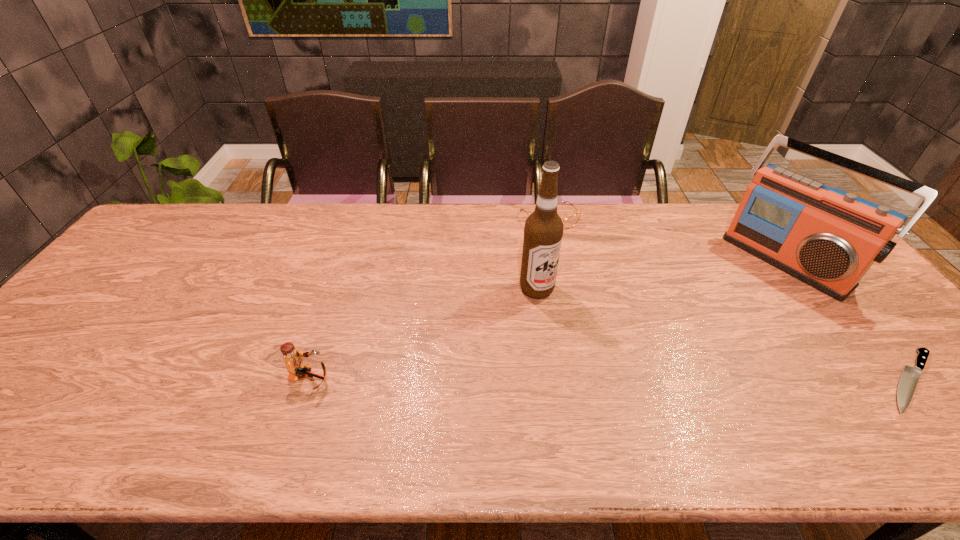
You are a GUI agent. You are given a task and a screenshot of the screen. Output one action in this format:
    pyautogui.click(x=<x>, y=<y>)
    Task: Click on the second closest object to the second shortest object
    
    Given the screenshot: What is the action you would take?
    pyautogui.click(x=828, y=238)